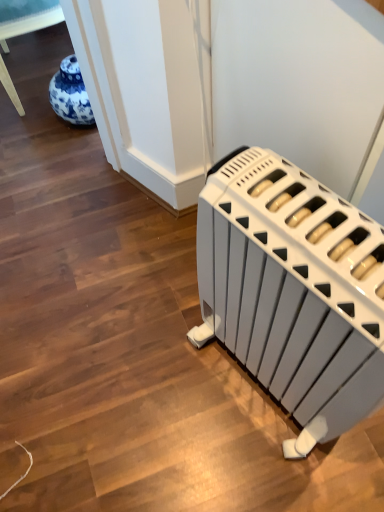
Where is `free location in front of white plastic heater at lower right`? Image resolution: width=384 pixels, height=512 pixels. free location in front of white plastic heater at lower right is located at coordinates (284, 472).